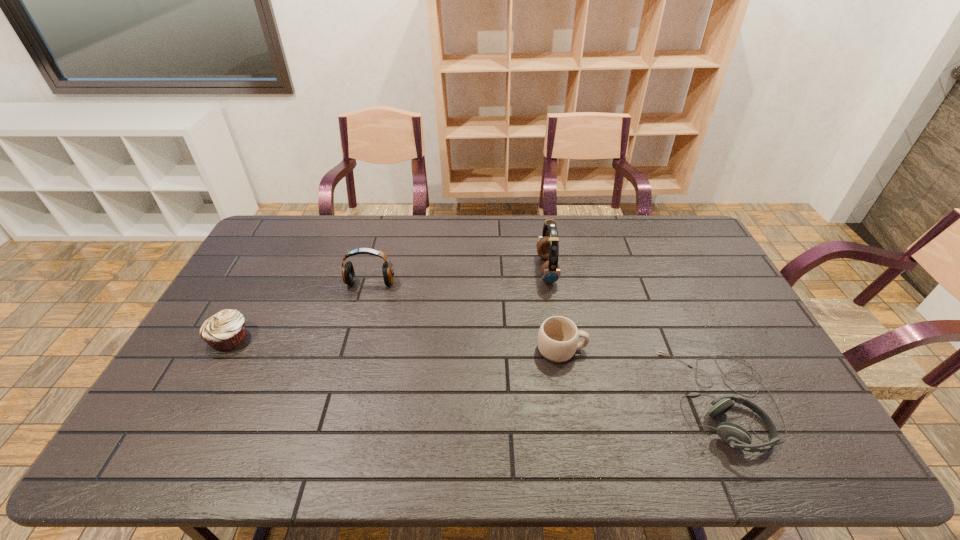
This screenshot has width=960, height=540. Find the location of `vacant region located on the ear cup of the tallest headset`. vacant region located on the ear cup of the tallest headset is located at coordinates (428, 270).

This screenshot has width=960, height=540. I want to click on vacant position located 0.150m on the ear cups of the second tallest object, so click(x=359, y=324).

The width and height of the screenshot is (960, 540). I want to click on vacant position located on the back of the muffin, so click(247, 307).

This screenshot has height=540, width=960. Identify the location of free space located on the side of the mug with the handle. (694, 349).

Where is `free space located on the outer surface of the rightmost headset`? This screenshot has height=540, width=960. free space located on the outer surface of the rightmost headset is located at coordinates [646, 400].

Locate an element on the screen. free space located 0.220m on the outer surface of the rightmost headset is located at coordinates (588, 400).

Locate an element on the screen. Image resolution: width=960 pixels, height=540 pixels. vacant space located on the outer surface of the rightmost headset is located at coordinates (565, 400).

The height and width of the screenshot is (540, 960). I want to click on object at the far edge, so click(x=548, y=244).

Locate an element on the screen. object that is at the near edge is located at coordinates (737, 437).

Find the location of a particular element. The image size is (960, 540). object present at the left edge is located at coordinates (225, 330).